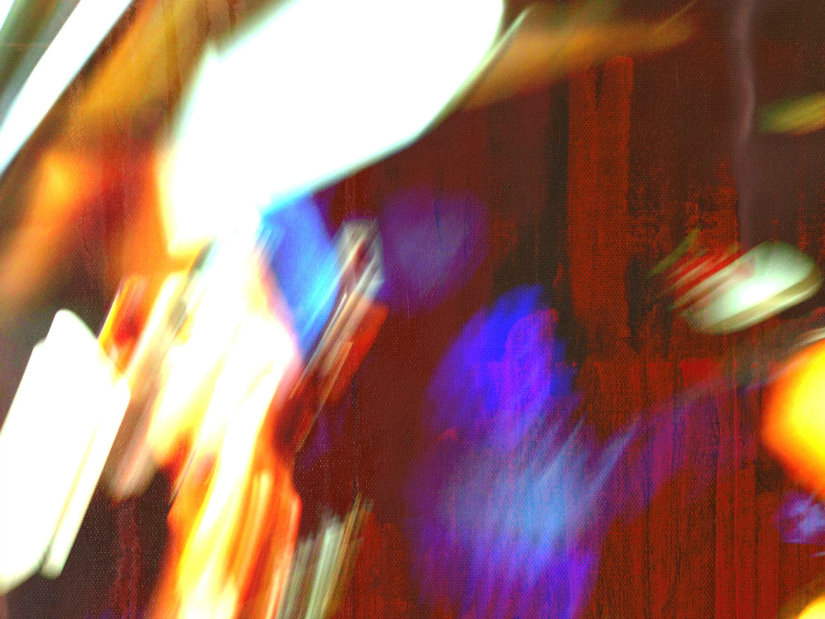
Where is `wooden boards`? This screenshot has height=619, width=825. wooden boards is located at coordinates pyautogui.click(x=582, y=176), pyautogui.click(x=606, y=163).